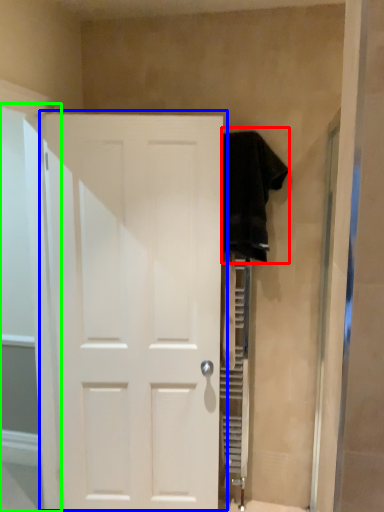
Question: Which is nearer to the clothing (highlighted by a red box)? door (highlighted by a blue box) or glass door (highlighted by a green box).

Choices:
 (A) door
 (B) glass door

Answer: (A)